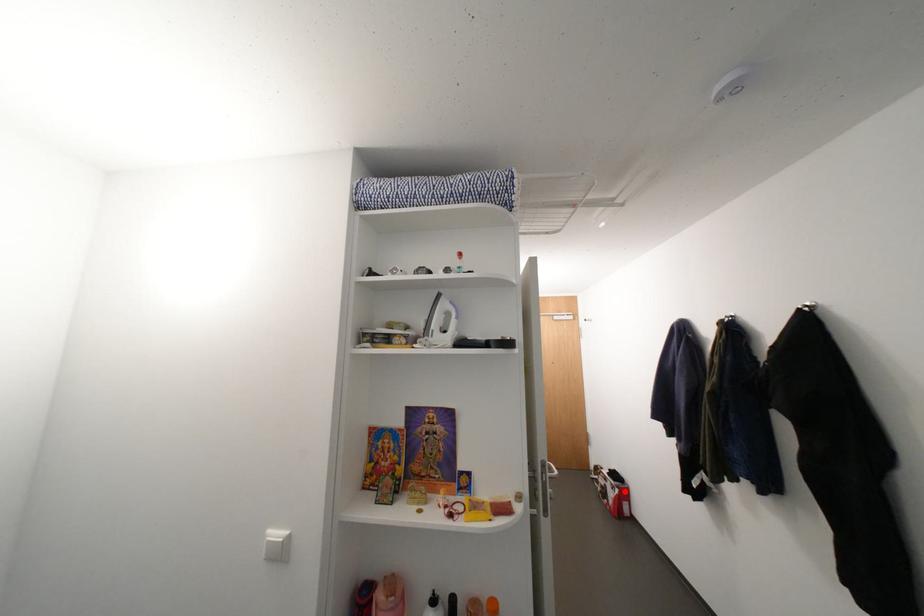
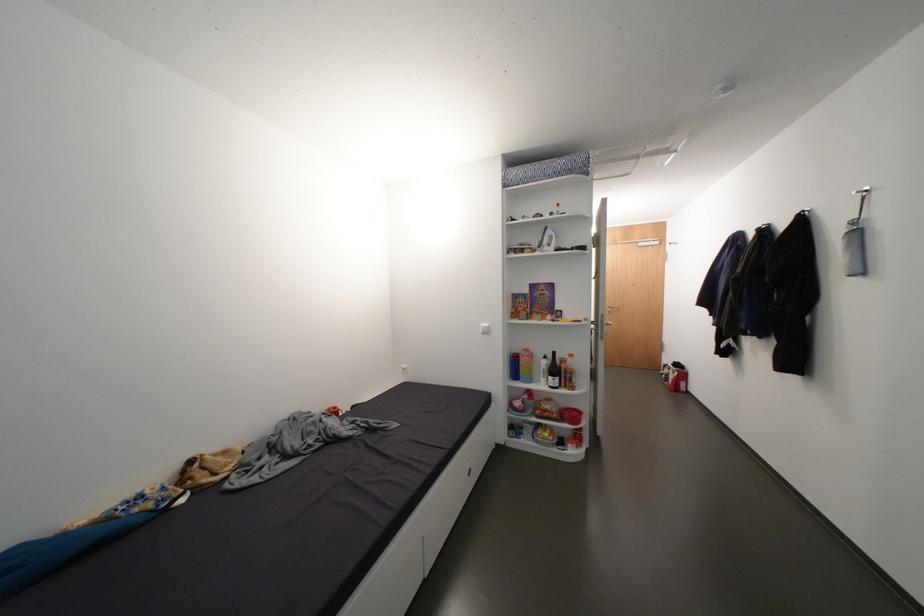
In the second image, find the point that corresponds to the highlighted location in the first image.

(684, 374)